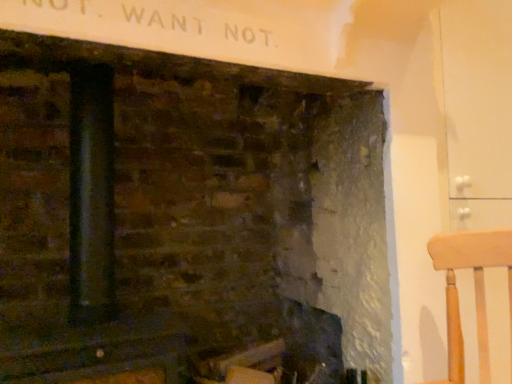
The height and width of the screenshot is (384, 512). Identify the location of dark brown brick fireplace at center. (187, 216).

Measure the distance between dark brown brick fireplace at center and camera.

dark brown brick fireplace at center is 1.01 meters away from camera.

What do you see at coordinates (187, 216) in the screenshot? I see `dark brown brick fireplace at center` at bounding box center [187, 216].

The width and height of the screenshot is (512, 384). What are the coordinates of `dark brown brick fireplace at center` in the screenshot? It's located at (187, 216).